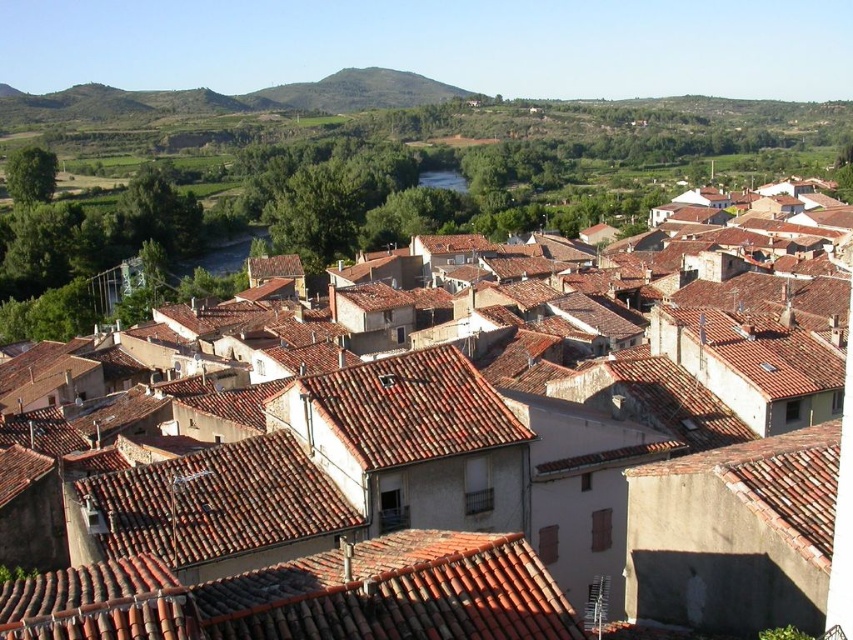
Is red clay tiles at center to the left of brown tile roof at center from the viewer's perspective?

Yes, red clay tiles at center is to the left of brown tile roof at center.

Is red clay tiles at center positioned behind brown tile roof at center?

No, it is not.

Is point (396, 579) less distant than point (384, 428)?

Yes, point (396, 579) is in front of point (384, 428).

The image size is (853, 640). Identify the location of red clay tiles at center. 310,596.

Is brown tile roofs at center taller than red clay tiles at center?

Indeed, brown tile roofs at center has a greater height compared to red clay tiles at center.

Is brown tile roofs at center closer to camera compared to red clay tiles at center?

No, brown tile roofs at center is behind red clay tiles at center.

Find the location of a particular element. brown tile roofs at center is located at coordinates (393, 474).

Is brown tile roofs at center above brown tile roof at center?

Yes, brown tile roofs at center is above brown tile roof at center.

Can you confirm if brown tile roofs at center is wider than brown tile roof at center?

Correct, the width of brown tile roofs at center exceeds that of brown tile roof at center.

Who is more distant from viewer, (329, 496) or (437, 385)?

Positioned behind is point (437, 385).

This screenshot has height=640, width=853. What are the coordinates of `brown tile roofs at center` in the screenshot? It's located at (393, 474).